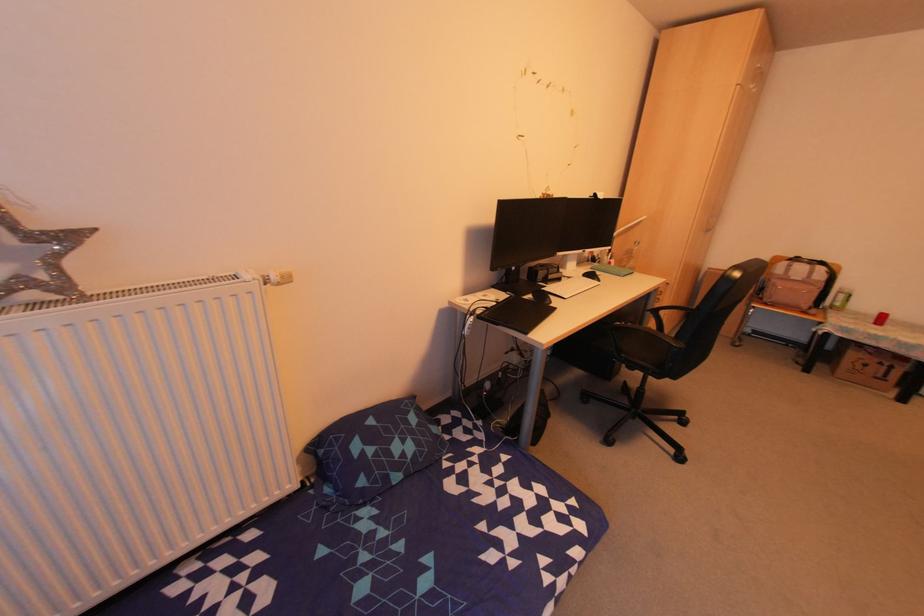
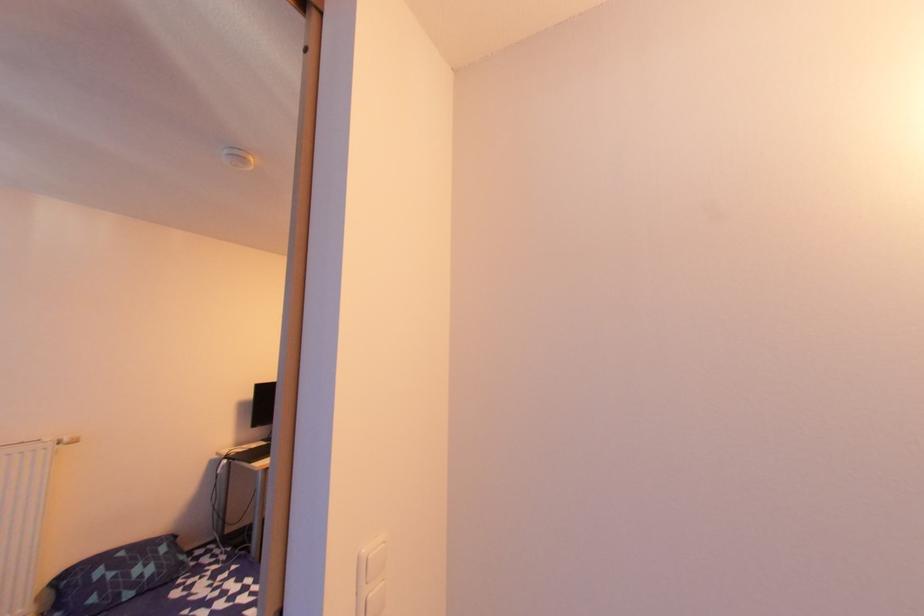
Find the pixel in the second image that matches pixel 360 488 in the first image.

(90, 605)